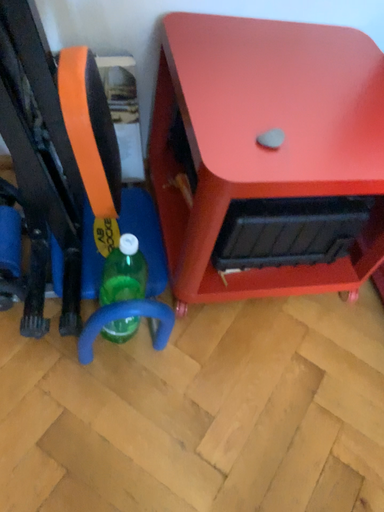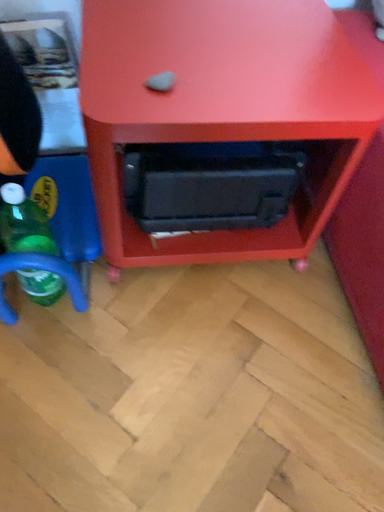
Question: How did the camera likely rotate when shooting the video?

Choices:
 (A) rotated right
 (B) rotated left

Answer: (B)